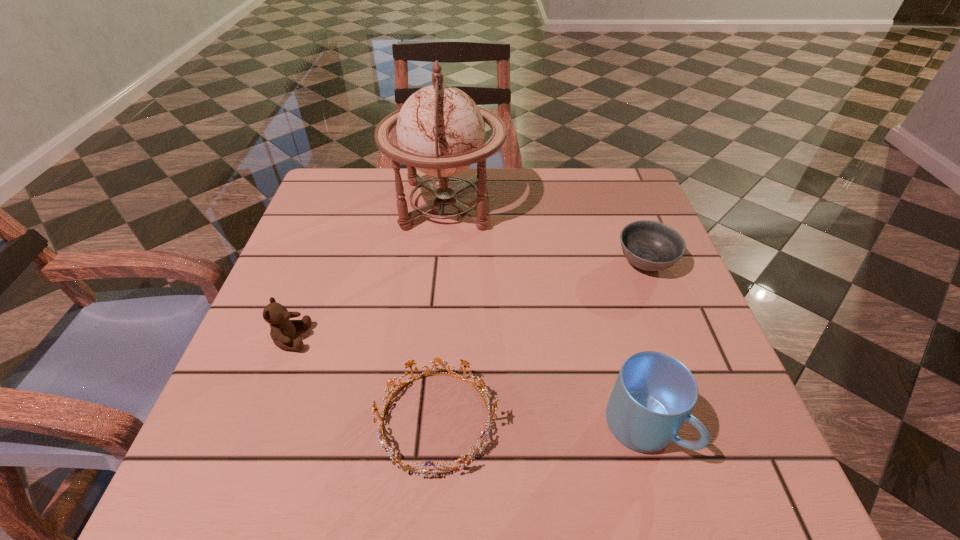
Where is `free spot that satisfies the following two spatial constraints: 1. at the front of the mug showing Africa; 2. on the right side of the globe`? free spot that satisfies the following two spatial constraints: 1. at the front of the mug showing Africa; 2. on the right side of the globe is located at coordinates (425, 427).

This screenshot has height=540, width=960. Find the location of `free space that satisfies the following two spatial constraints: 1. at the front of the globe showing Africa; 2. on the left side of the mug`. free space that satisfies the following two spatial constraints: 1. at the front of the globe showing Africa; 2. on the left side of the mug is located at coordinates (425, 427).

Where is `vacant space that satisfies the following two spatial constraints: 1. on the front-facing side of the teddy bear; 2. on the right side of the mug`? The height and width of the screenshot is (540, 960). vacant space that satisfies the following two spatial constraints: 1. on the front-facing side of the teddy bear; 2. on the right side of the mug is located at coordinates (257, 427).